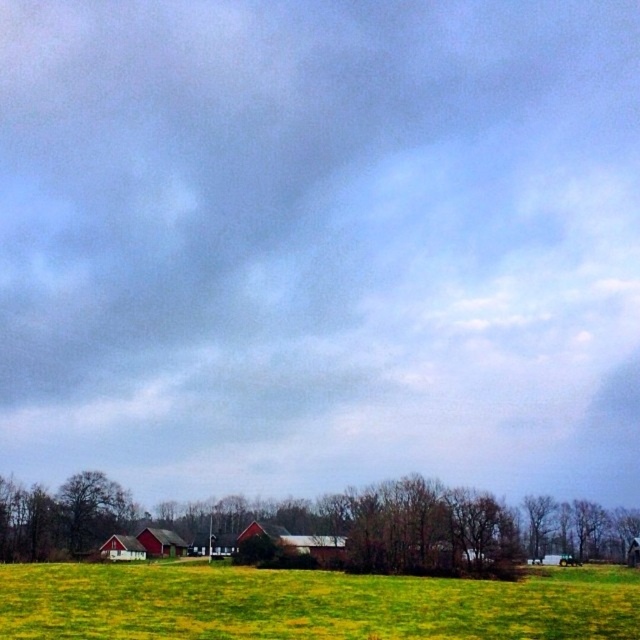
Question: Does green grass pasture at lower center have a smaller size compared to green leafy tree at lower right?

Choices:
 (A) no
 (B) yes

Answer: (A)

Question: Which of the following is the farthest from the observer?

Choices:
 (A) green grass pasture at lower center
 (B) green leafy tree at lower right
 (C) brown textured tree at lower center

Answer: (B)

Question: Considering the relative positions of green grass pasture at lower center and brown textured tree at lower center in the image provided, where is green grass pasture at lower center located with respect to brown textured tree at lower center?

Choices:
 (A) left
 (B) right

Answer: (B)

Question: Where is green grass pasture at lower center located in relation to brown textured tree at lower center in the image?

Choices:
 (A) above
 (B) below

Answer: (A)

Question: Which point is farther to the camera?

Choices:
 (A) brown textured tree at lower center
 (B) green leafy tree at lower right
 (C) green grass pasture at lower center

Answer: (B)

Question: Which point is closer to the camera?

Choices:
 (A) (522, 506)
 (B) (224, 616)

Answer: (B)